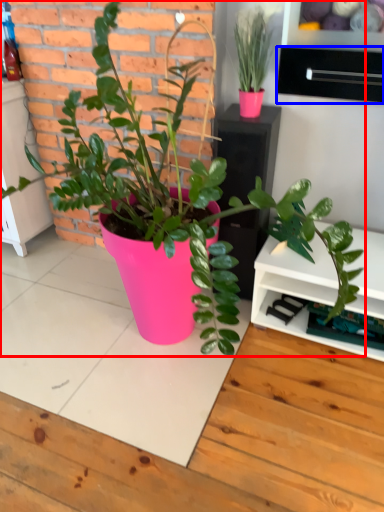
Question: Among these objects, which one is farthest to the camera, houseplant (highlighted by a red box) or drawer (highlighted by a blue box)?

Choices:
 (A) houseplant
 (B) drawer

Answer: (B)